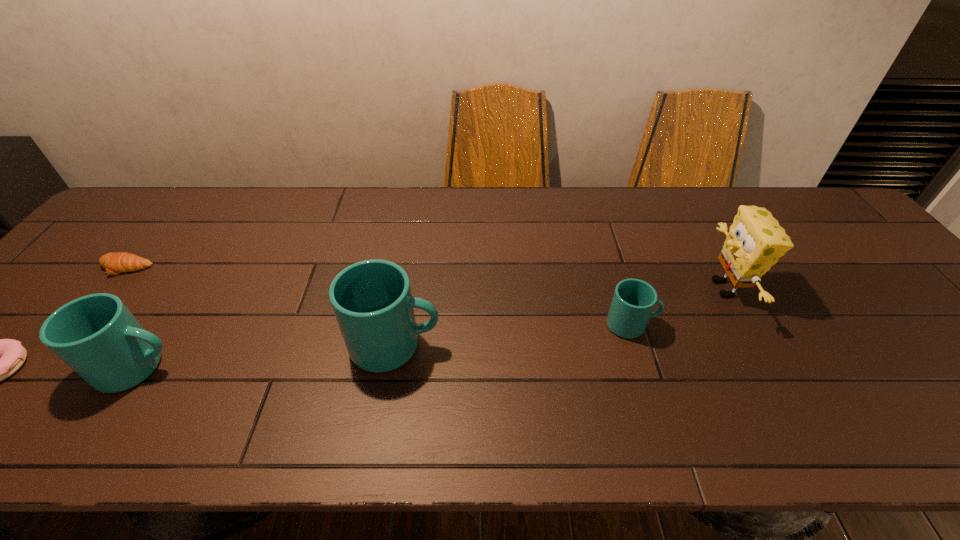
Where is `vacant space at the near left corner`? vacant space at the near left corner is located at coordinates (29, 394).

Locate an element on the screen. blank space at the far right corner of the desktop is located at coordinates (797, 200).

Where is `vacant space that is in between the second object from right to left and the fourth object from left to right`? The image size is (960, 540). vacant space that is in between the second object from right to left and the fourth object from left to right is located at coordinates (x=514, y=335).

Where is `free space between the rightmost object and the rightmost cup`? free space between the rightmost object and the rightmost cup is located at coordinates (678, 307).

The width and height of the screenshot is (960, 540). What are the coordinates of `empty space that is in between the third object from right to left and the crescent roll` in the screenshot? It's located at (260, 307).

Locate an element on the screen. the fifth closest object to the crescent roll is located at coordinates (755, 241).

Point out which object is positioned as the second nearest to the doughnut. Please provide its 2D coordinates. Your answer should be formatted as a tuple, i.e. [(x, y)], where the tuple contains the x and y coordinates of a point satisfying the conditions above.

[(114, 263)]

I want to click on cup identified as the closest to the rightmost cup, so click(372, 301).

Identify which cup is the nearest to the third shortest object. Please provide its 2D coordinates. Your answer should be formatted as a tuple, i.e. [(x, y)], where the tuple contains the x and y coordinates of a point satisfying the conditions above.

[(372, 301)]